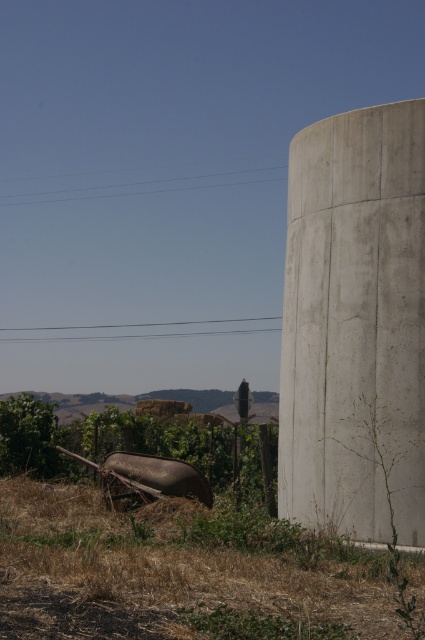
You are standing at point A and want to walk to point B. There are two points marked in the image. The first point is at coordinate point A at (119,515) and the second point is at coordinate point B at (351,532). Which point is closer to you when you are at point A?

Point A at (119,515) is closer to you because you are already at point A.

You are standing in the middle ground of the rural scene. You see the brown rusted wheelbarrow at lower left and the dry grass at right. Which object is positioned lower in the image?

The brown rusted wheelbarrow at lower left is located below dry grass at right, so the brown rusted wheelbarrow at lower left is positioned lower in the image.

You are standing in the middle ground of the rural scene. You see the brown rusted wheelbarrow at lower left and the concrete at right. Which object is positioned lower in the image?

The brown rusted wheelbarrow at lower left is positioned lower than the concrete at right in the image.